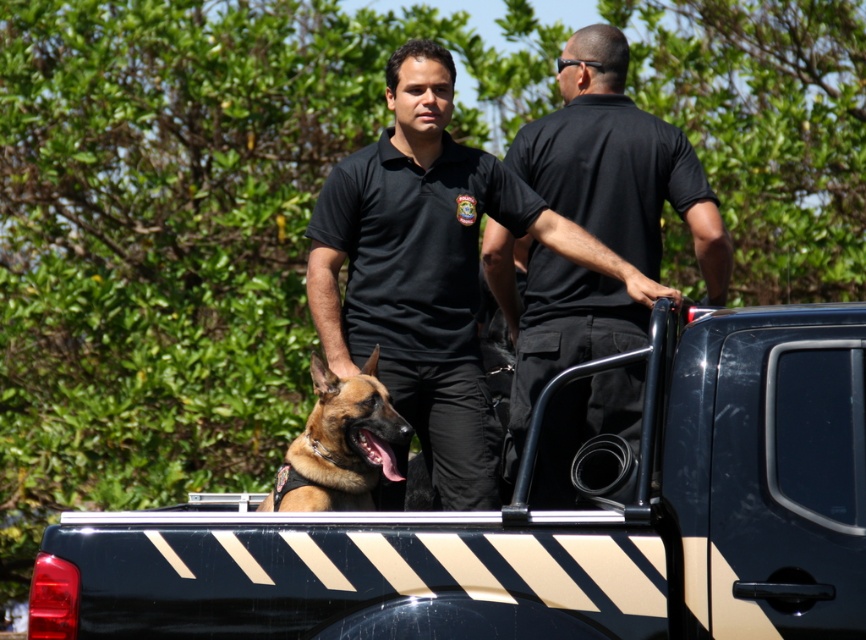
You are a photographer positioned behind the brown fur dog at center. You want to take a photo of the metallic black truck bed at center without the dog blocking it. Based on the scene, is the dog currently blocking the truck bed from your view?

The metallic black truck bed at center is in front of the brown fur dog at center, so the dog is not blocking the truck bed from your view.

You are standing at the origin point of the coordinate system. You want to walk to the metallic black truck bed at center. What direction should you walk to reach it?

The metallic black truck bed at center is located at coordinate point 0.822 on the x axis and 0.627 on the y axis. Since the truck bed is at a higher x and y coordinate than the origin, you should walk northeast to reach it.

You are a photographer trying to capture a photo of the brown fur dog at center. The metallic black truck bed at center is blocking your view. Can you suggest a way to position yourself so that the dog is visible without the truck bed in the frame?

The metallic black truck bed at center is much taller than the brown fur dog at center, so you can position yourself higher than the truck bed to see over it or move to the side where the truck bed does not block the dog.